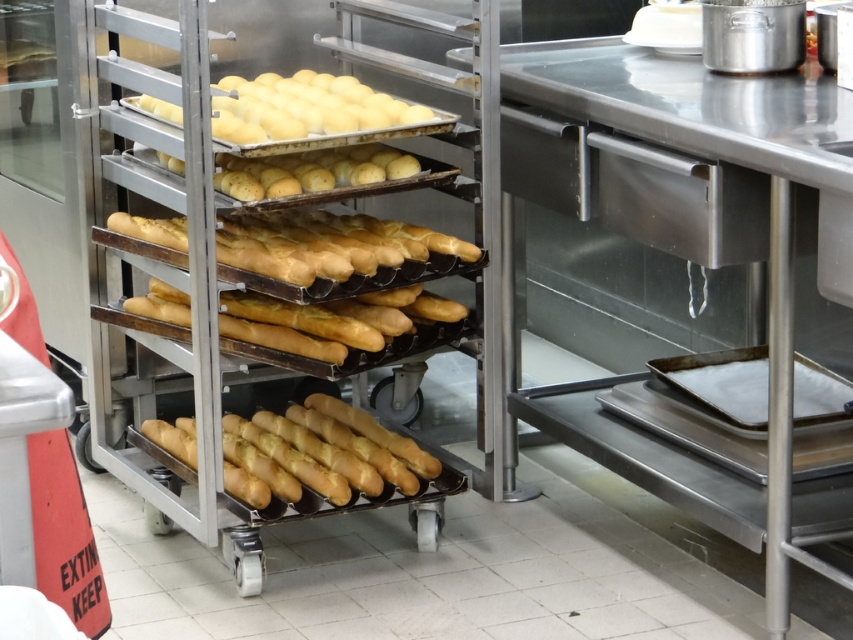
You are a baker who just entered the bakery and want to grab the golden matte baguette at center. Based on the coordinates provided, where should you look to find it?

The golden matte baguette at center is located at coordinates point (325,451).

You are a baker who needs to stack these items in a display case. The display case has a height limit of 15 cm. If the golden matte baguette at center is 10 cm tall and the yellow matte doughnuts at center are 12 cm tall, will both items fit vertically in the display case without exceeding the height limit?

The golden matte baguette at center is 10 cm tall and the yellow matte doughnuts at center are 12 cm tall. Since both items are under the 15 cm height limit individually, they can be placed in the display case without exceeding the height limit.

You are a baker who needs to select the largest baguette from the rolling rack. Which one should you choose between the golden matte baguette at center and the golden matte baguettes at center?

The golden matte baguette at center is larger in size compared to the golden matte baguettes at center, so you should choose the golden matte baguette at center.